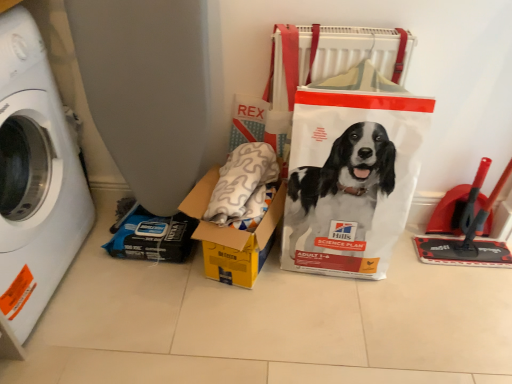
You are a GUI agent. You are given a task and a screenshot of the screen. Output one action in this format:
    pyautogui.click(x=<x>, y=<y>)
    Task: Click on the free point to the right of white plastic bag at center
    
    Given the screenshot: What is the action you would take?
    pyautogui.click(x=414, y=282)